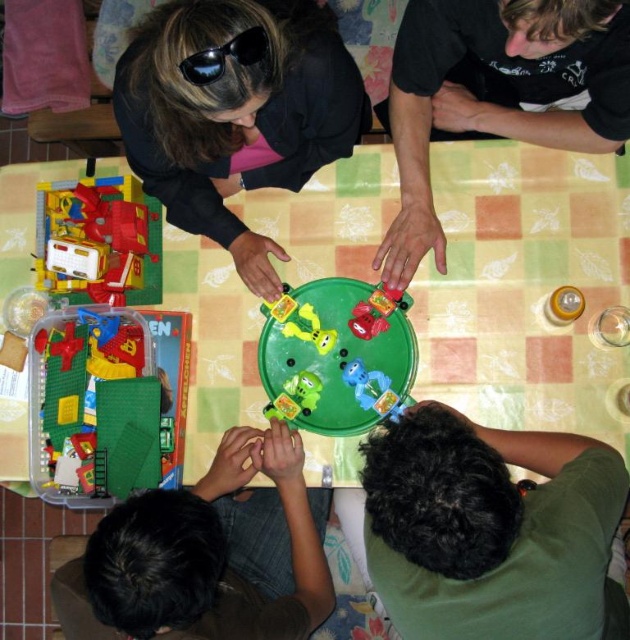
Question: Which point appears closest to the camera in this image?

Choices:
 (A) (462, 387)
 (B) (461, 449)
 (C) (152, 49)

Answer: (B)

Question: Among these points, which one is farthest from the camera?

Choices:
 (A) (243, 474)
 (B) (444, 90)

Answer: (B)

Question: Where is dark green shirt at lower right located in relation to translucent yellow bottle at upper right in the image?

Choices:
 (A) right
 (B) left

Answer: (B)

Question: Is translucent yellow plastic toy car at upper left thinner than sunglasses at upper center?

Choices:
 (A) yes
 (B) no

Answer: (B)

Question: Based on their relative distances, which object is farther from the rubberized green toy car at center?

Choices:
 (A) green plastic bricks at center
 (B) translucent yellow bottle at upper right
 (C) sunglasses at upper center
 (D) smooth black shirt at upper right

Answer: (C)

Question: Does green plastic bricks at center have a lesser width compared to translucent yellow bottle at upper right?

Choices:
 (A) yes
 (B) no

Answer: (B)